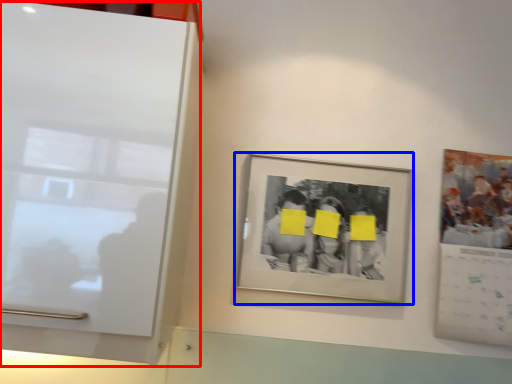
Question: Which of the following is the closest to the observer, glass door (highlighted by a red box) or picture frame (highlighted by a blue box)?

Choices:
 (A) glass door
 (B) picture frame

Answer: (A)